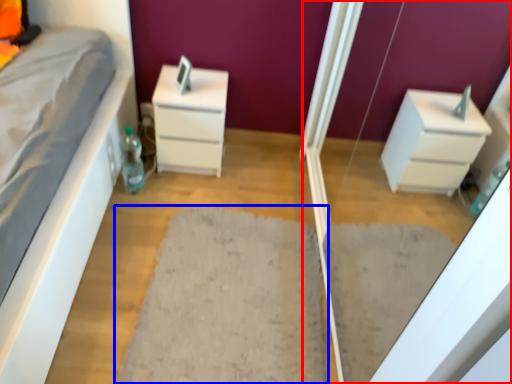
Question: Which object is further to the camera taking this photo, screen door (highlighted by a red box) or doormat (highlighted by a blue box)?

Choices:
 (A) screen door
 (B) doormat

Answer: (B)